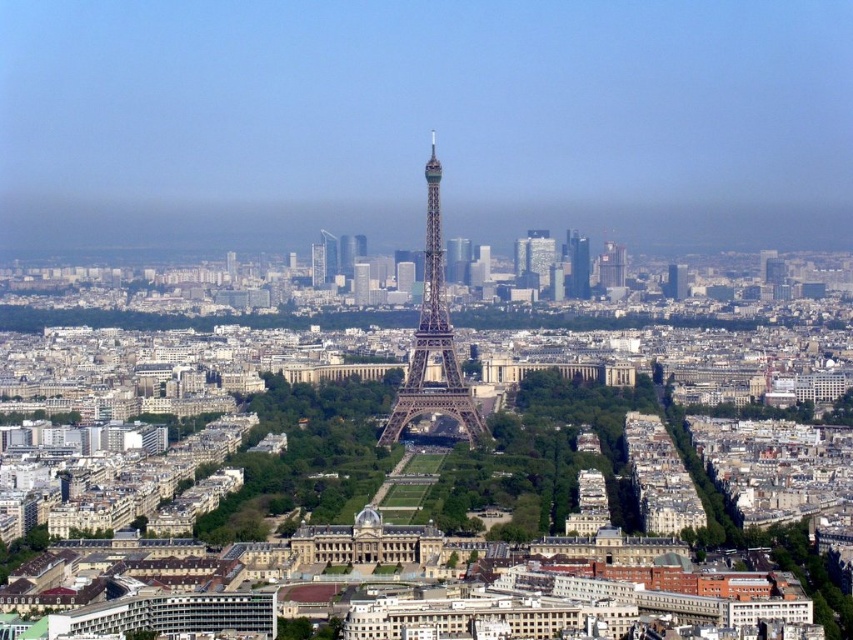
Question: Is painted steel eiffel tower at center bigger than smooth glass skyscraper at center?

Choices:
 (A) yes
 (B) no

Answer: (A)

Question: Does painted steel eiffel tower at center appear on the right side of smooth glass skyscraper at center?

Choices:
 (A) no
 (B) yes

Answer: (A)

Question: Which object appears closest to the camera in this image?

Choices:
 (A) painted steel eiffel tower at center
 (B) smooth glass skyscraper at center

Answer: (A)

Question: Does painted steel eiffel tower at center appear over smooth glass skyscraper at center?

Choices:
 (A) no
 (B) yes

Answer: (B)